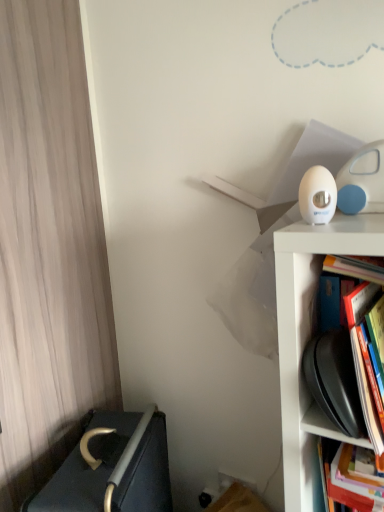
Question: Should I look upward or downward to see hardcover book at right, arranged as the first book when ordered from the bottom?

Choices:
 (A) down
 (B) up

Answer: (A)

Question: From a real-world perspective, is hardcover book at right, which is the 2th book in bottom-to-top order, physically below dark gray fabric bed at lower left?

Choices:
 (A) no
 (B) yes

Answer: (A)

Question: Does hardcover book at right, which is the 1th book from top to bottom, come behind dark gray fabric bed at lower left?

Choices:
 (A) yes
 (B) no

Answer: (B)

Question: Considering the relative sizes of hardcover book at right, which is the 2th book in bottom-to-top order, and dark gray fabric bed at lower left in the image provided, is hardcover book at right, which is the 2th book in bottom-to-top order, taller than dark gray fabric bed at lower left?

Choices:
 (A) no
 (B) yes

Answer: (A)

Question: Does hardcover book at right, which is the 2th book in bottom-to-top order, have a smaller size compared to dark gray fabric bed at lower left?

Choices:
 (A) no
 (B) yes

Answer: (B)

Question: From a real-world perspective, does hardcover book at right, which is the 1th book from top to bottom, stand above dark gray fabric bed at lower left?

Choices:
 (A) yes
 (B) no

Answer: (A)

Question: Is hardcover book at right, which is the 2th book in bottom-to-top order, in front of dark gray fabric bed at lower left?

Choices:
 (A) no
 (B) yes

Answer: (B)

Question: From the image's perspective, is dark gray fabric bed at lower left located above hardcover book at right, which is the 1th book from top to bottom?

Choices:
 (A) no
 (B) yes

Answer: (A)

Question: Would you say dark gray fabric bed at lower left is a long distance from hardcover book at right, which is the 2th book in bottom-to-top order?

Choices:
 (A) no
 (B) yes

Answer: (A)

Question: Is dark gray fabric bed at lower left shorter than hardcover book at right, which is the 2th book in bottom-to-top order?

Choices:
 (A) yes
 (B) no

Answer: (B)

Question: Is dark gray fabric bed at lower left to the left of hardcover book at right, which is the 1th book from top to bottom, from the viewer's perspective?

Choices:
 (A) no
 (B) yes

Answer: (B)

Question: Is hardcover book at right, which is the 1th book from top to bottom, completely or partially inside dark gray fabric bed at lower left?

Choices:
 (A) yes
 (B) no

Answer: (B)

Question: Does dark gray fabric bed at lower left have a greater height compared to hardcover book at right, which is the 1th book from top to bottom?

Choices:
 (A) yes
 (B) no

Answer: (A)

Question: Can you confirm if dark gray fabric bed at lower left is smaller than hardcover book at right, positioned as the second book in top-to-bottom order?

Choices:
 (A) no
 (B) yes

Answer: (A)